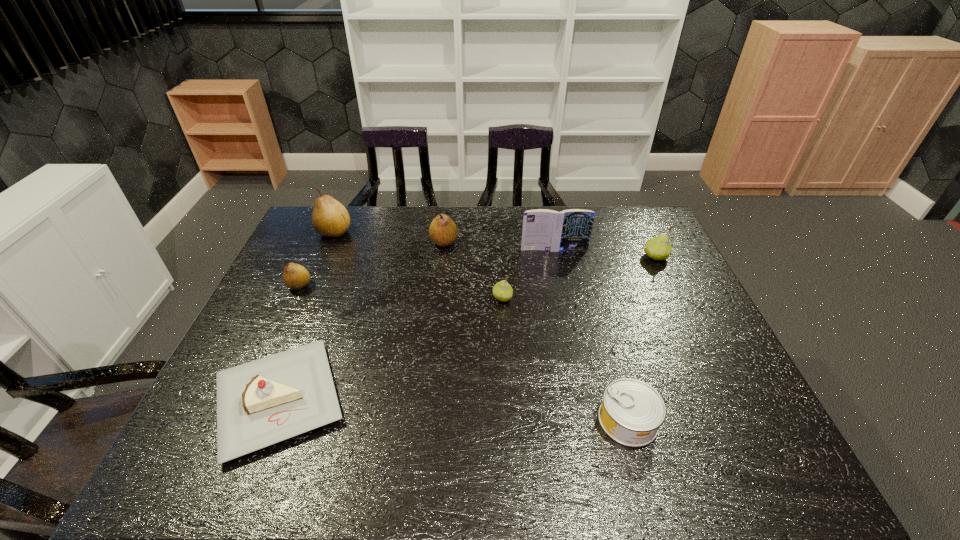
Locate an element on the screen. This screenshot has width=960, height=540. can is located at coordinates (632, 411).

You are a GUI agent. You are given a task and a screenshot of the screen. Output one action in this format:
    pyautogui.click(x=<x>, y=<y>)
    Task: Click on the free location located 0.170m on the right of the tallest pear
    Image resolution: width=960 pixels, height=540 pixels.
    Given the screenshot: What is the action you would take?
    pyautogui.click(x=401, y=232)

Identify the location of vacant space located on the front cover of the book. (568, 320).

You are a GUI agent. You are given a task and a screenshot of the screen. Output one action in this format:
    pyautogui.click(x=<x>, y=<y>)
    Task: Click on the free point located on the back of the rightmost brown pear
    The width and height of the screenshot is (960, 540).
    Given the screenshot: What is the action you would take?
    pyautogui.click(x=446, y=226)

Identify the location of free point located 0.240m on the left of the bigger green pear. Image resolution: width=960 pixels, height=540 pixels. (569, 257).

You are a GUI agent. You are given a task and a screenshot of the screen. Output one action in this format:
    pyautogui.click(x=<x>, y=<y>)
    Task: Click on the blank space located on the right of the nearest brown pear
    This screenshot has width=960, height=540.
    Given the screenshot: What is the action you would take?
    pyautogui.click(x=377, y=286)

The height and width of the screenshot is (540, 960). What are the coordinates of `vacant space situated on the right of the left green pear` in the screenshot? It's located at pos(561,298).

Where is `free space located 0.300m on the back of the cake`? free space located 0.300m on the back of the cake is located at coordinates (329, 271).

Where is `free point located on the left of the silver can`? This screenshot has height=540, width=960. free point located on the left of the silver can is located at coordinates (501, 420).

At what (x,y) coordinates should I click in order to perform the action: click on cake that is at the near edge. Please return your answer as a coordinate pair (x, y). The width and height of the screenshot is (960, 540). Looking at the image, I should click on (260, 403).